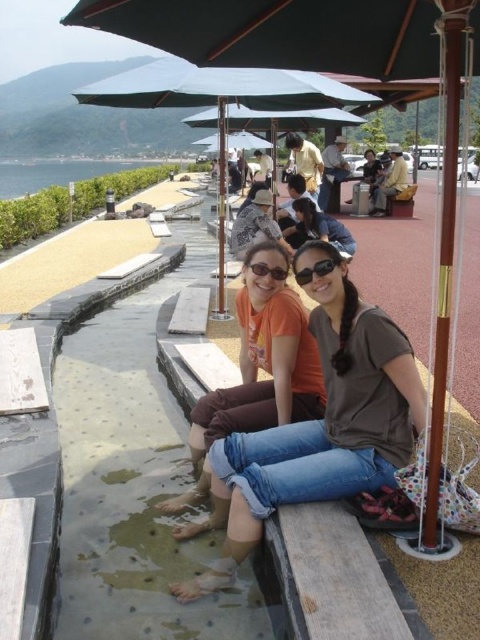
Is point (388, 372) farther from camera compared to point (251, 269)?

No, (388, 372) is closer to viewer.

At what (x,y) coordinates should I click in order to perform the action: click on denim jeans at center. Please return your answer as a coordinate pair (x, y). Looking at the image, I should click on (319, 426).

The image size is (480, 640). What do you see at coordinates (319, 426) in the screenshot? I see `denim jeans at center` at bounding box center [319, 426].

Where is `denim jeans at center`? This screenshot has height=640, width=480. denim jeans at center is located at coordinates (319, 426).

Does green fabric umbrella at center lie behind matte black sunglasses at center?

No, it is in front of matte black sunglasses at center.

Is point (253, 108) closer to viewer compared to point (273, 273)?

No, (253, 108) is further to viewer.

Identify the location of green fabric umbrella at center. (219, 99).

Does denim jeans at center appear under green fabric umbrella at center?

Yes.

Who is positioned more to the right, denim jeans at center or green fabric umbrella at center?

From the viewer's perspective, denim jeans at center appears more on the right side.

Between point (229, 573) and point (120, 80), which one is positioned in front?

Point (229, 573)

Identify the location of denim jeans at center. (319, 426).